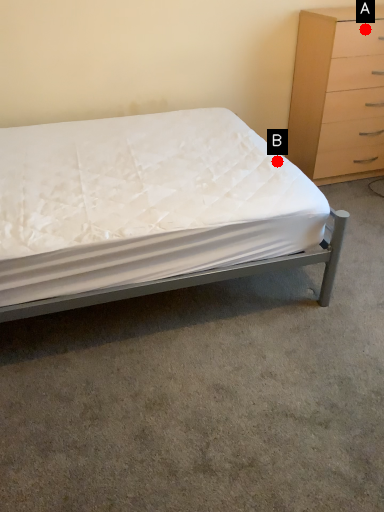
Question: Two points are circled on the image, labeled by A and B beside each circle. Which point is closer to the camera?

Choices:
 (A) A is closer
 (B) B is closer

Answer: (B)